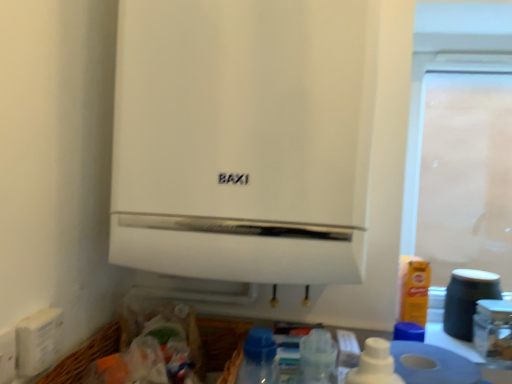
Question: Is white matte boiler at center in front of or behind white plastic electric outlet at lower left in the image?

Choices:
 (A) behind
 (B) front

Answer: (A)

Question: From their relative heights in the image, would you say white matte boiler at center is taller or shorter than white plastic electric outlet at lower left?

Choices:
 (A) short
 (B) tall

Answer: (B)

Question: Considering the real-world distances, which object is farthest from the transparent plastic screen door at upper right?

Choices:
 (A) matte black jar at lower right
 (B) white matte toilet paper at lower right
 (C) white plastic electric outlet at lower left
 (D) white matte boiler at center

Answer: (C)

Question: Which of these objects is positioned closest to the white plastic electric outlet at lower left?

Choices:
 (A) white matte toilet paper at lower right
 (B) matte black jar at lower right
 (C) transparent plastic screen door at upper right
 (D) white matte boiler at center

Answer: (D)